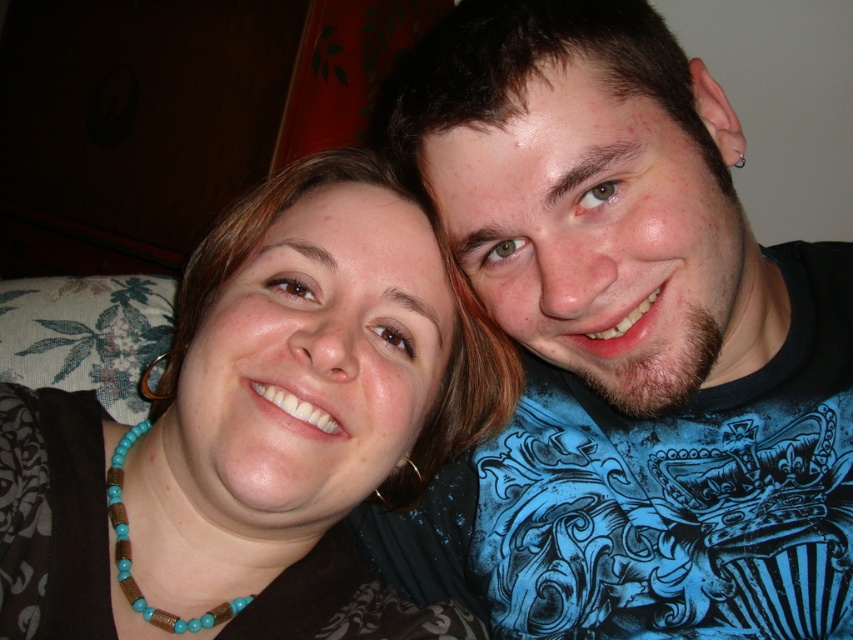
Question: Among these objects, which one is nearest to the camera?

Choices:
 (A) brown fabric at center
 (B) blue printed shirt at right

Answer: (A)

Question: From the image, what is the correct spatial relationship of blue printed shirt at right in relation to turquoise wood beads at lower center?

Choices:
 (A) above
 (B) below

Answer: (A)

Question: Which point is closer to the camera taking this photo?

Choices:
 (A) (173, 349)
 (B) (114, 556)
 (C) (819, 298)

Answer: (B)

Question: Which of the following is the farthest from the observer?

Choices:
 (A) turquoise wood beads at lower center
 (B) blue printed shirt at right

Answer: (A)

Question: Is blue printed shirt at right positioned behind turquoise wood beads at lower center?

Choices:
 (A) yes
 (B) no

Answer: (B)

Question: Does blue printed shirt at right have a lesser width compared to brown fabric at center?

Choices:
 (A) no
 (B) yes

Answer: (A)